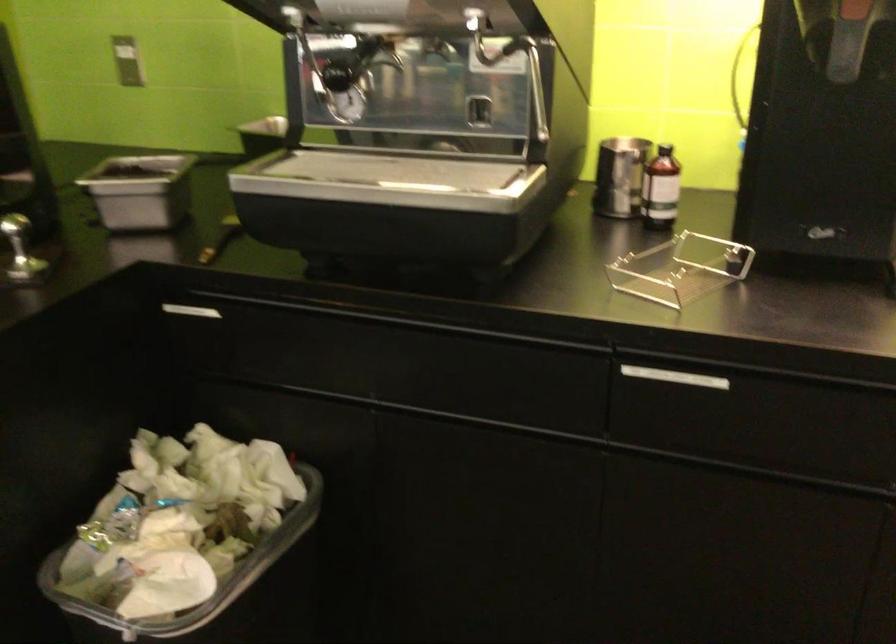
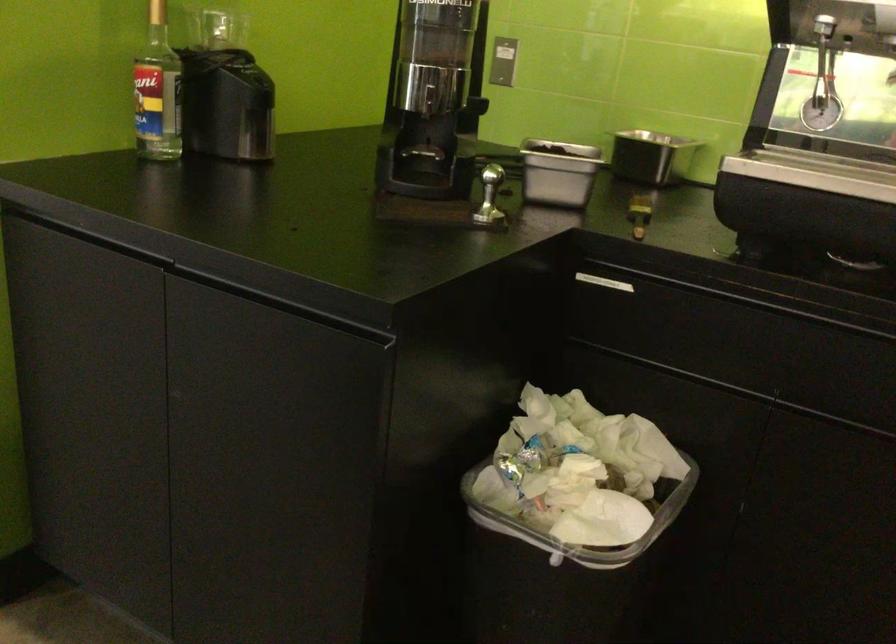
Locate, in the second image, the point that corresponds to pixel 133 201 in the first image.

(558, 172)